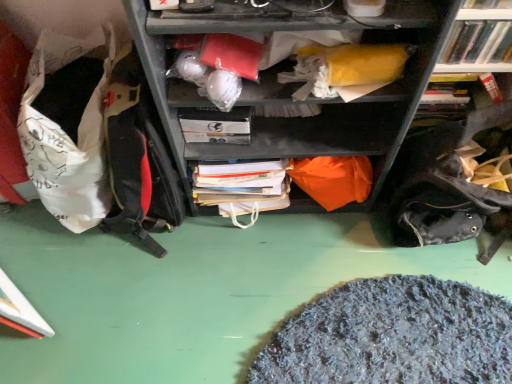
Question: Can you confirm if white fabric bean bag at left is bigger than white plastic books at upper right?

Choices:
 (A) yes
 (B) no

Answer: (A)

Question: From the image's perspective, is white fabric bean bag at left beneath white plastic books at upper right?

Choices:
 (A) no
 (B) yes

Answer: (B)

Question: Does white fabric bean bag at left come behind white plastic books at upper right?

Choices:
 (A) no
 (B) yes

Answer: (A)

Question: Is white fabric bean bag at left turned away from white plastic books at upper right?

Choices:
 (A) no
 (B) yes

Answer: (A)

Question: Is white fabric bean bag at left smaller than white plastic books at upper right?

Choices:
 (A) no
 (B) yes

Answer: (A)

Question: Relative to white fabric bean bag at left, is white matte paperback book at center in front or behind?

Choices:
 (A) behind
 (B) front

Answer: (A)

Question: Is white matte paperback book at center bigger or smaller than white fabric bean bag at left?

Choices:
 (A) small
 (B) big

Answer: (A)

Question: From the image's perspective, is white matte paperback book at center located above or below white fabric bean bag at left?

Choices:
 (A) above
 (B) below

Answer: (A)

Question: Considering the positions of point (245, 142) and point (86, 110), is point (245, 142) closer or farther from the camera than point (86, 110)?

Choices:
 (A) closer
 (B) farther

Answer: (A)

Question: Is white fabric bean bag at left inside the boundaries of white matte paperback book at center, or outside?

Choices:
 (A) inside
 (B) outside

Answer: (B)

Question: Considering the positions of white fabric bean bag at left and white matte paperback book at center in the image, is white fabric bean bag at left bigger or smaller than white matte paperback book at center?

Choices:
 (A) big
 (B) small

Answer: (A)

Question: From a real-world perspective, is white fabric bean bag at left above or below white matte paperback book at center?

Choices:
 (A) below
 (B) above

Answer: (A)

Question: Is white fabric bean bag at left taller or shorter than white matte paperback book at center?

Choices:
 (A) tall
 (B) short

Answer: (A)

Question: Considering their positions, is white plastic books at upper right located in front of or behind white matte paperback book at center?

Choices:
 (A) behind
 (B) front

Answer: (B)

Question: From a real-world perspective, is white plastic books at upper right physically located above or below white matte paperback book at center?

Choices:
 (A) above
 (B) below

Answer: (A)